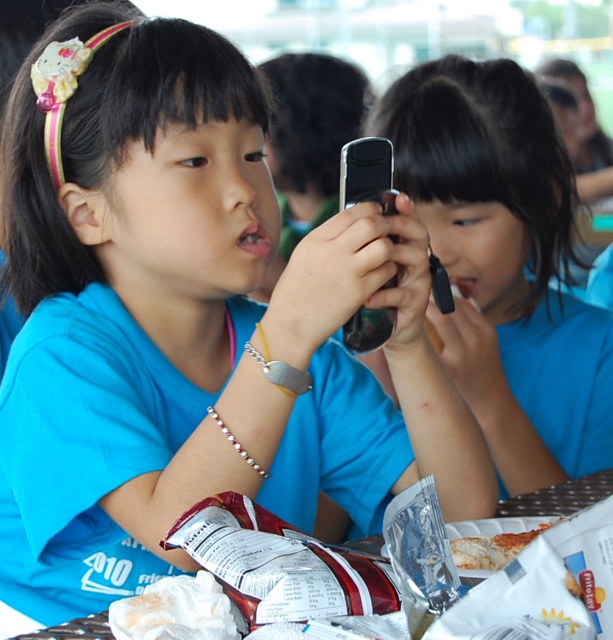
You are a parent trying to place a snack for your child on the table. The metallic silver table at lower center and the white paper plate at lower center are both in view. Which object should you place the snack on to ensure it stays stable?

The metallic silver table at lower center is positioned under the white paper plate at lower center, so placing the snack on the metallic silver table at lower center will ensure stability.

You are a photographer trying to capture a closeup shot of the matte black phone at center and the metallic silver table at lower center. Since you want both objects to appear equally large in the photo, which object should you move closer to the camera?

The matte black phone at center is larger than the metallic silver table at lower center. To make both appear the same size in the photo, move the smaller metallic silver table at lower center closer to the camera while keeping the larger matte black phone at center farther back.

You are standing 50 inches away from the table where the children are sitting. You want to reach the point at coordinates point (x=595, y=484) on the table. Can you determine if you can extend your hand to reach that point without moving closer?

The distance of point (x=595, y=484) from viewer is 37.30 inches. Since you are currently 50 inches away, you need to move 12.7 inches closer to reach it.